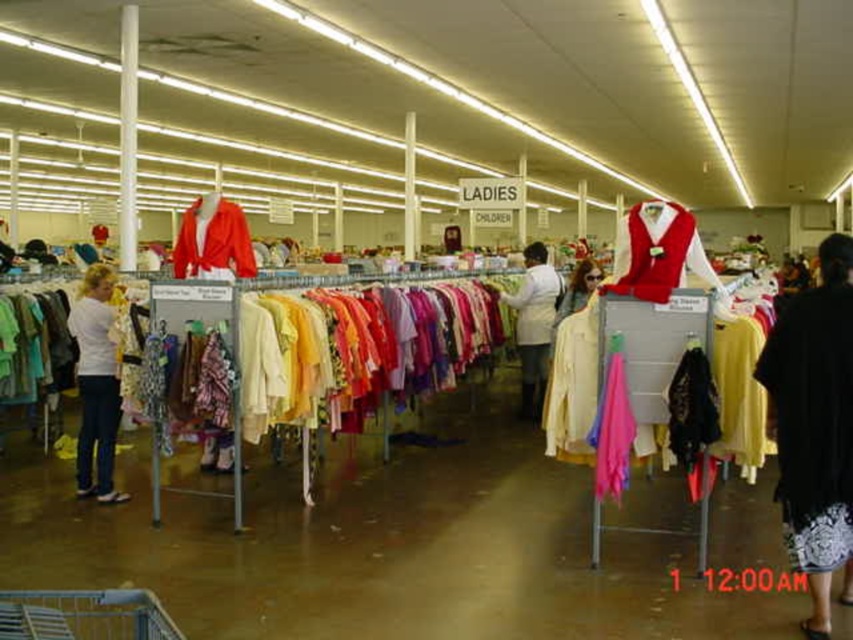
Question: Among these points, which one is nearest to the camera?

Choices:
 (A) (547, 260)
 (B) (192, 259)
 (C) (570, 298)
 (D) (833, 497)

Answer: (D)

Question: Which object appears farthest from the camera in this image?

Choices:
 (A) white matte jacket at center
 (B) matte red blazer at center
 (C) black matte dress at lower right
 (D) matte white blouse at center

Answer: (A)

Question: Is the position of velvet red vest at center more distant than that of white matte jacket at center?

Choices:
 (A) no
 (B) yes

Answer: (A)

Question: Does matte red blazer at center appear over matte white blouse at center?

Choices:
 (A) yes
 (B) no

Answer: (A)

Question: Based on their relative distances, which object is nearer to the matte white blouse at center?

Choices:
 (A) matte red blazer at center
 (B) velvet red vest at center
 (C) white matte shirt at left

Answer: (B)

Question: In this image, where is white matte shirt at left located relative to matte red blazer at center?

Choices:
 (A) below
 (B) above

Answer: (A)